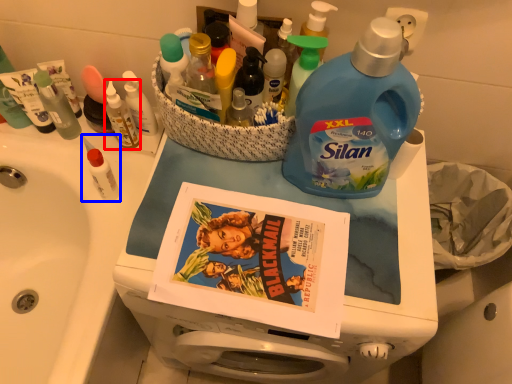
Question: Which point is further to the camera, toiletry (highlighted by a red box) or toiletry (highlighted by a blue box)?

Choices:
 (A) toiletry
 (B) toiletry

Answer: (A)